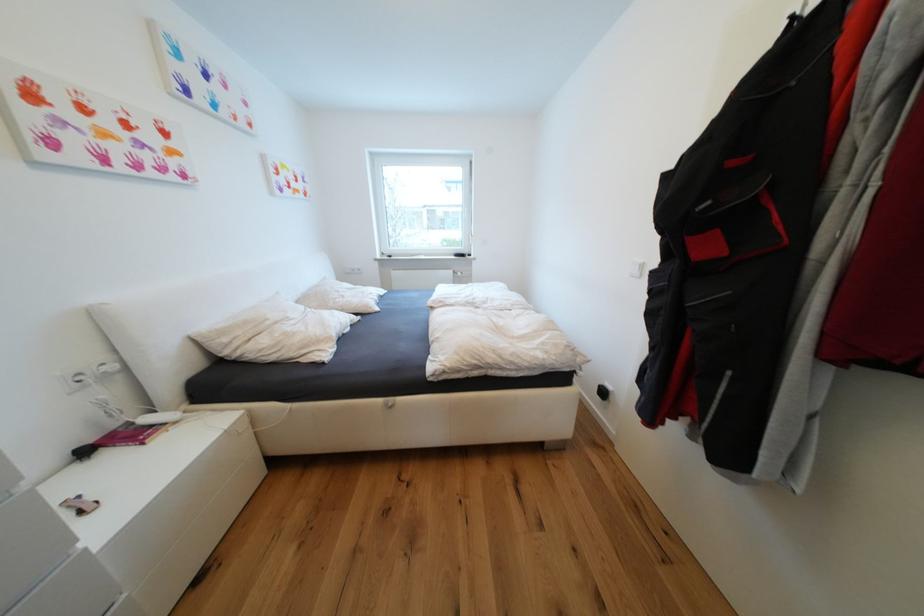
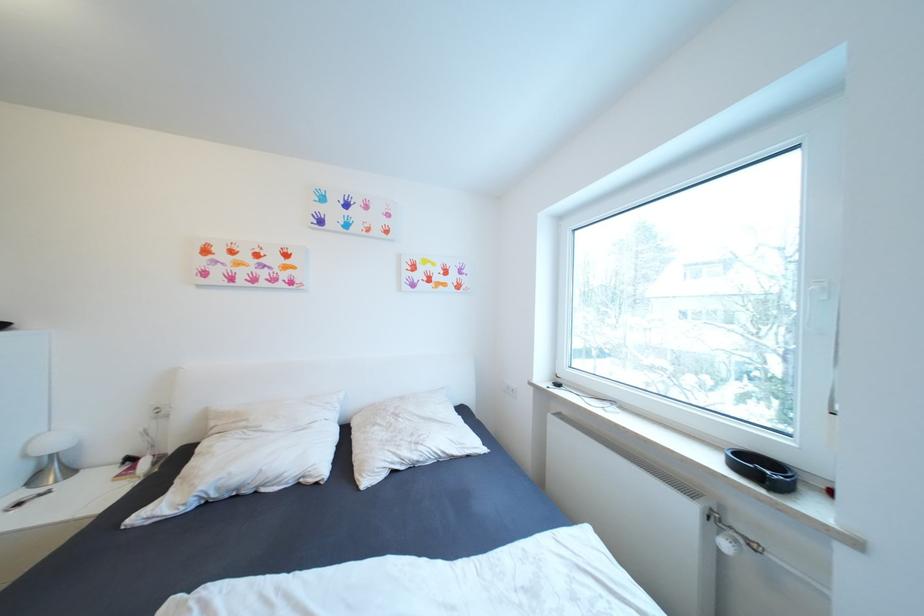
Find the pixel in the second image that matches the point at 233,341 in the first image.

(220, 424)